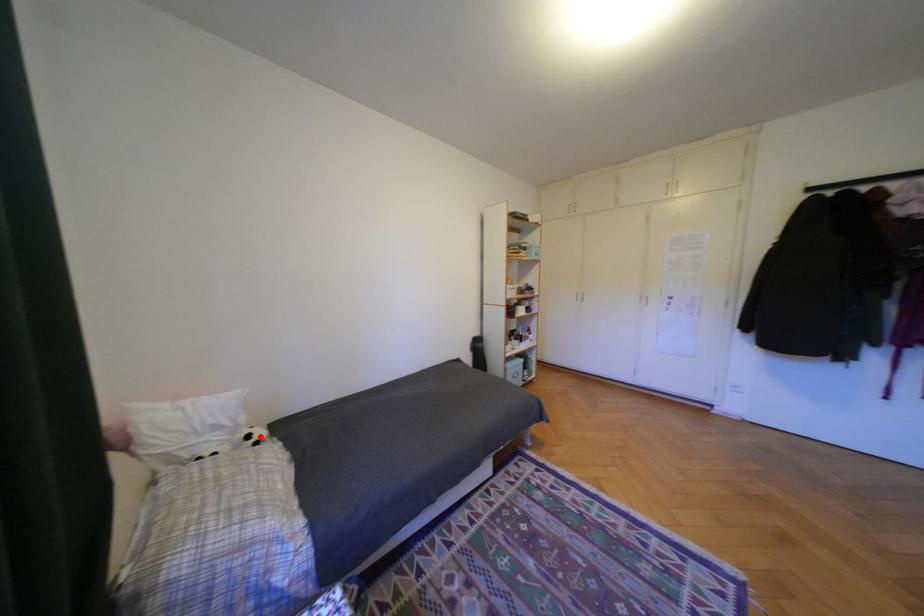
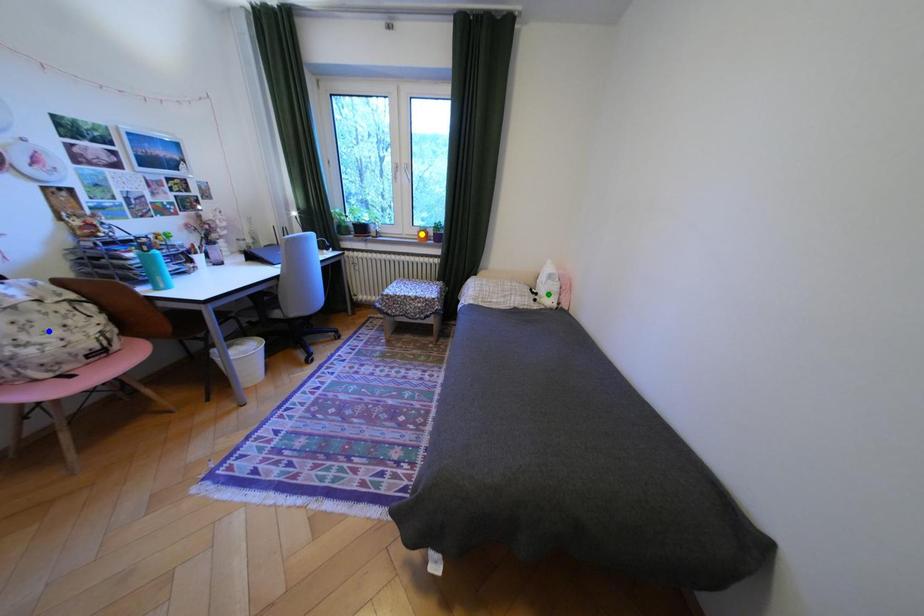
Question: I am providing you with two images of the same scene from different viewpoints. A red point is marked on the first image. You are given multiple points on the second image. In image 2, which mark is for the same physical point as the one in image 1?

Choices:
 (A) yellow point
 (B) blue point
 (C) green point

Answer: (C)